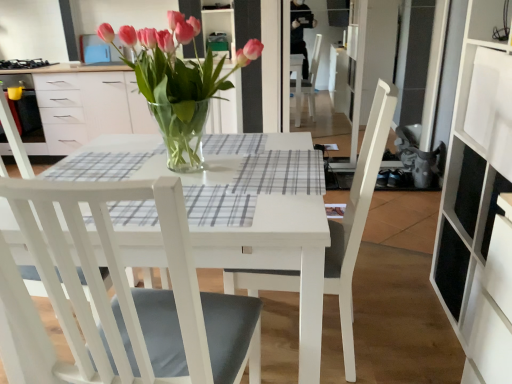
Question: Can you confirm if black matte gas stove at upper left is smaller than pink glass vase at center?

Choices:
 (A) no
 (B) yes

Answer: (B)

Question: Considering the relative positions of black matte gas stove at upper left and pink glass vase at center in the image provided, is black matte gas stove at upper left to the right of pink glass vase at center from the viewer's perspective?

Choices:
 (A) no
 (B) yes

Answer: (A)

Question: Is black matte gas stove at upper left far from pink glass vase at center?

Choices:
 (A) yes
 (B) no

Answer: (A)

Question: From a real-world perspective, is black matte gas stove at upper left below pink glass vase at center?

Choices:
 (A) yes
 (B) no

Answer: (A)

Question: Can you confirm if black matte gas stove at upper left is wider than pink glass vase at center?

Choices:
 (A) yes
 (B) no

Answer: (A)

Question: From a real-world perspective, relative to white wood chair at center, acting as the 1th chair starting from the right, is black matte gas stove at upper left vertically above or below?

Choices:
 (A) above
 (B) below

Answer: (A)

Question: Is point (4, 66) closer or farther from the camera than point (289, 284)?

Choices:
 (A) closer
 (B) farther

Answer: (B)

Question: In terms of size, does black matte gas stove at upper left appear bigger or smaller than white wood chair at center, acting as the 1th chair starting from the right?

Choices:
 (A) small
 (B) big

Answer: (A)

Question: Considering the positions of black matte gas stove at upper left and white wood chair at center, placed as the 2th chair when sorted from left to right, in the image, is black matte gas stove at upper left wider or thinner than white wood chair at center, placed as the 2th chair when sorted from left to right,?

Choices:
 (A) wide
 (B) thin

Answer: (B)

Question: From the image's perspective, is white wood chair at center, placed as the 2th chair when sorted from left to right, above or below gray checkered placemat at center?

Choices:
 (A) above
 (B) below

Answer: (B)

Question: Is white wood chair at center, acting as the 1th chair starting from the right, spatially inside gray checkered placemat at center, or outside of it?

Choices:
 (A) outside
 (B) inside

Answer: (A)

Question: In the image, is white wood chair at center, placed as the 2th chair when sorted from left to right, on the left side or the right side of gray checkered placemat at center?

Choices:
 (A) left
 (B) right

Answer: (B)

Question: Is white wood chair at center, acting as the 1th chair starting from the right, bigger or smaller than gray checkered placemat at center?

Choices:
 (A) small
 (B) big

Answer: (B)

Question: From a real-world perspective, is pink glass vase at center above or below white matte chair at center, placed as the first chair when sorted from left to right?

Choices:
 (A) above
 (B) below

Answer: (A)

Question: Would you say pink glass vase at center is to the left or to the right of white matte chair at center, which is counted as the 2th chair, starting from the right, in the picture?

Choices:
 (A) right
 (B) left

Answer: (A)